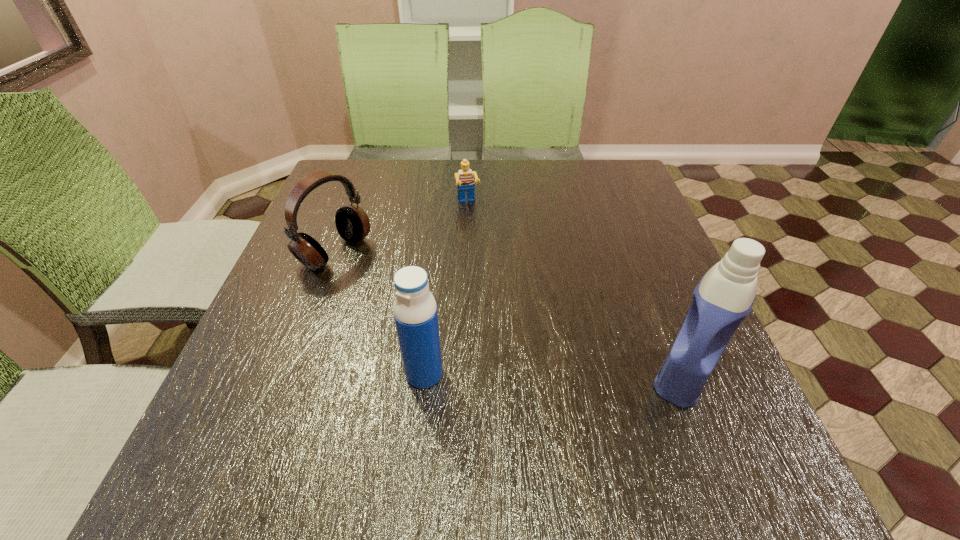
Where is `free space on the desktop that is between the third shortest object and the detergent and is positioned on the face of the second object from right to left`? This screenshot has height=540, width=960. free space on the desktop that is between the third shortest object and the detergent and is positioned on the face of the second object from right to left is located at coordinates (516, 374).

I want to click on vacant space on the desktop that is between the water bottle and the detergent and is positioned on the ear pads of the third tallest object, so click(553, 374).